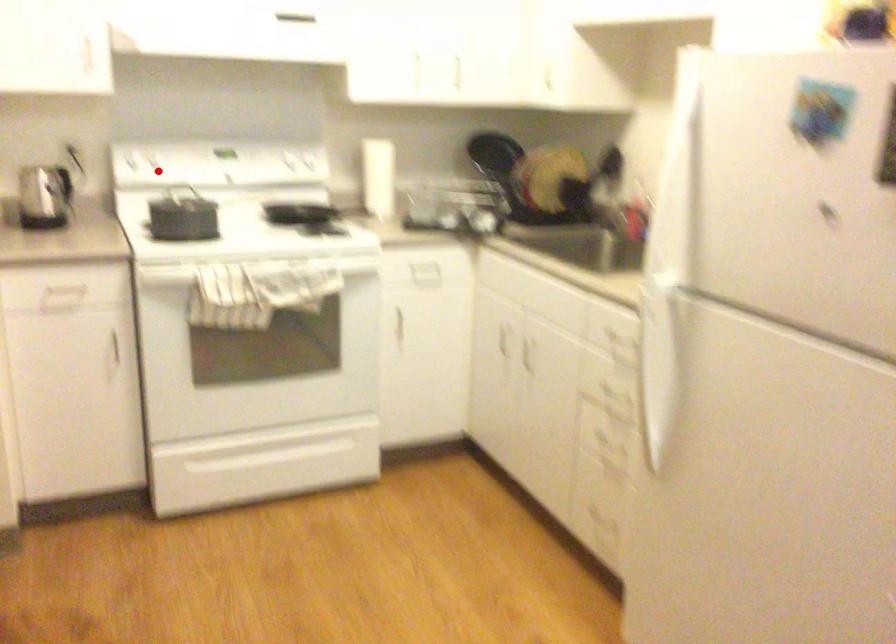
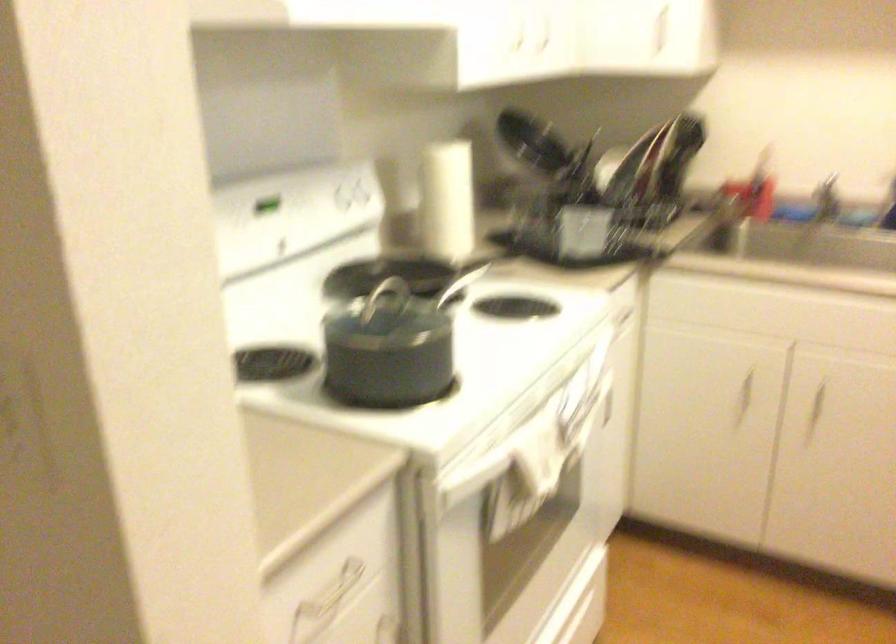
Question: I am providing you with two images of the same scene from different viewpoints. A red point is marked on the first image. Is the red point's position out of view in image 2?

Choices:
 (A) Yes
 (B) No

Answer: (A)